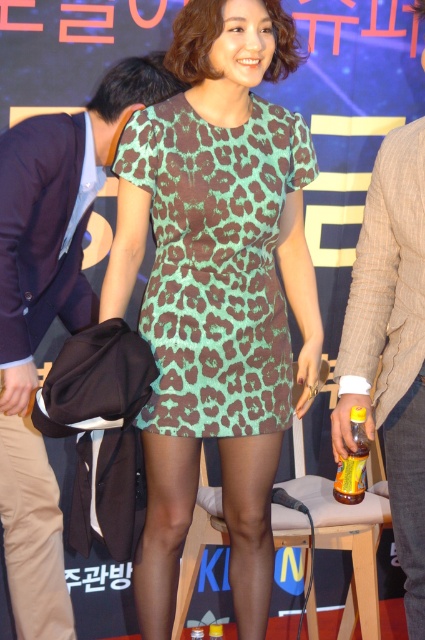
The image size is (425, 640). Describe the element at coordinates (215, 264) in the screenshot. I see `green leopard print dress at center` at that location.

Between green leopard print dress at center and black leather pants at lower center, which one is positioned lower?

black leather pants at lower center is lower down.

Who is more forward, (158,353) or (411,451)?

Point (411,451) is more forward.

Where is `green leopard print dress at center`? green leopard print dress at center is located at coordinates (215, 264).

How much distance is there between brown textured blazer at center and black leather pants at lower center?

brown textured blazer at center is 4.37 inches away from black leather pants at lower center.

Is point (331, 413) farther from viewer compared to point (413, 630)?

Yes.

This screenshot has height=640, width=425. I want to click on brown textured blazer at center, so click(391, 346).

Is green leopard print dress at center below yellow glass bottle at lower center?

Incorrect, green leopard print dress at center is not positioned below yellow glass bottle at lower center.

Between point (306, 145) and point (342, 499), which one is positioned behind?

Positioned behind is point (306, 145).

Between point (215, 355) and point (360, 460), which one is positioned behind?

Point (215, 355)

This screenshot has height=640, width=425. Identify the location of green leopard print dress at center. (215, 264).